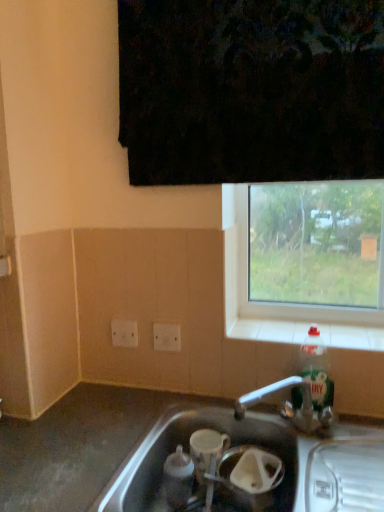
Question: Is white plastic electric outlet at lower left, which is the 1th electric outlet in back-to-front order, not within translucent plastic bottle at right?

Choices:
 (A) no
 (B) yes

Answer: (B)

Question: Is white plastic electric outlet at lower left, which is the 1th electric outlet in back-to-front order, touching translucent plastic bottle at right?

Choices:
 (A) yes
 (B) no

Answer: (B)

Question: From a real-world perspective, is white plastic electric outlet at lower left, the second electric outlet in the right-to-left sequence, over translucent plastic bottle at right?

Choices:
 (A) no
 (B) yes

Answer: (B)

Question: From the image's perspective, does white plastic electric outlet at lower left, which is the 1th electric outlet in back-to-front order, appear lower than translucent plastic bottle at right?

Choices:
 (A) no
 (B) yes

Answer: (A)

Question: Is white plastic electric outlet at lower left, which is the 1th electric outlet in back-to-front order, further to the viewer compared to translucent plastic bottle at right?

Choices:
 (A) no
 (B) yes

Answer: (B)

Question: Considering the positions of clear glass window at upper right and white plastic electric outlet at center, positioned as the second electric outlet in left-to-right order, in the image, is clear glass window at upper right taller or shorter than white plastic electric outlet at center, positioned as the second electric outlet in left-to-right order,?

Choices:
 (A) tall
 (B) short

Answer: (A)

Question: In terms of size, does clear glass window at upper right appear bigger or smaller than white plastic electric outlet at center, which appears as the first electric outlet when viewed from the front?

Choices:
 (A) small
 (B) big

Answer: (B)

Question: Is clear glass window at upper right spatially inside white plastic electric outlet at center, the 1th electric outlet when ordered from right to left, or outside of it?

Choices:
 (A) inside
 (B) outside

Answer: (B)

Question: Is clear glass window at upper right wider or thinner than white plastic electric outlet at center, the 1th electric outlet when ordered from right to left?

Choices:
 (A) thin
 (B) wide

Answer: (B)

Question: Is silver metallic sink at lower center to the left or to the right of clear glass window at upper right in the image?

Choices:
 (A) left
 (B) right

Answer: (A)

Question: Relative to clear glass window at upper right, is silver metallic sink at lower center in front or behind?

Choices:
 (A) behind
 (B) front

Answer: (B)

Question: From a real-world perspective, is silver metallic sink at lower center positioned above or below clear glass window at upper right?

Choices:
 (A) below
 (B) above

Answer: (A)

Question: Looking at the image, does silver metallic sink at lower center seem bigger or smaller compared to clear glass window at upper right?

Choices:
 (A) small
 (B) big

Answer: (B)

Question: From the image's perspective, is silver metallic sink at lower center located above or below white tile at lower right?

Choices:
 (A) below
 (B) above

Answer: (A)

Question: Based on their sizes in the image, would you say silver metallic sink at lower center is bigger or smaller than white tile at lower right?

Choices:
 (A) big
 (B) small

Answer: (A)